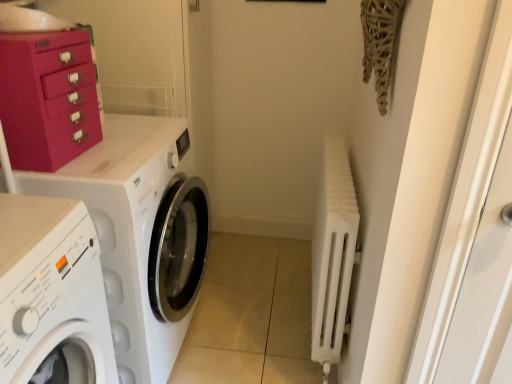
Find the location of a particular element. vacant space to the right of matte pink cabinet at upper left is located at coordinates (122, 154).